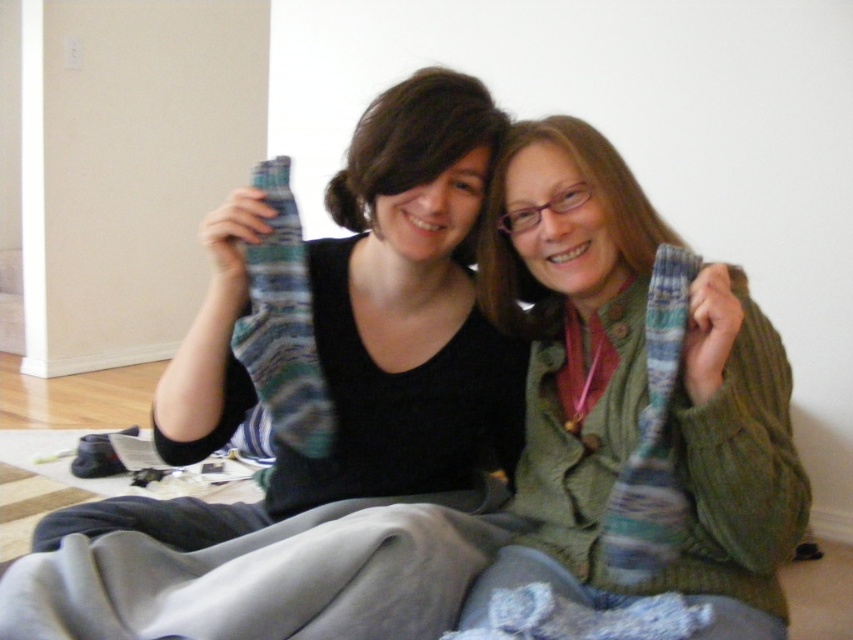
Does striped wool socks at center appear on the right side of knitted wool scarf at right?

No, striped wool socks at center is not to the right of knitted wool scarf at right.

Is striped wool socks at center wider than knitted wool scarf at right?

Indeed, striped wool socks at center has a greater width compared to knitted wool scarf at right.

Between point (325, 486) and point (682, 268), which one is positioned behind?

The point (325, 486) is more distant.

What are the coordinates of `striped wool socks at center` in the screenshot? It's located at (381, 328).

Who is positioned more to the left, striped wool socks at center or striped wool sock at upper center?

striped wool sock at upper center

Does striped wool socks at center have a lesser height compared to striped wool sock at upper center?

Incorrect, striped wool socks at center's height does not fall short of striped wool sock at upper center's.

What do you see at coordinates (381, 328) in the screenshot?
I see `striped wool socks at center` at bounding box center [381, 328].

Locate an element on the screen. The height and width of the screenshot is (640, 853). striped wool socks at center is located at coordinates (381, 328).

Is striped wool sock at upper center smaller than knitted wool scarf at right?

Actually, striped wool sock at upper center might be larger than knitted wool scarf at right.

How distant is striped wool sock at upper center from knitted wool scarf at right?

striped wool sock at upper center is 42.22 centimeters from knitted wool scarf at right.

Is point (283, 224) in front of point (621, 524)?

No, (283, 224) is behind (621, 524).

Image resolution: width=853 pixels, height=640 pixels. Find the location of `striped wool sock at upper center`. striped wool sock at upper center is located at coordinates (283, 324).